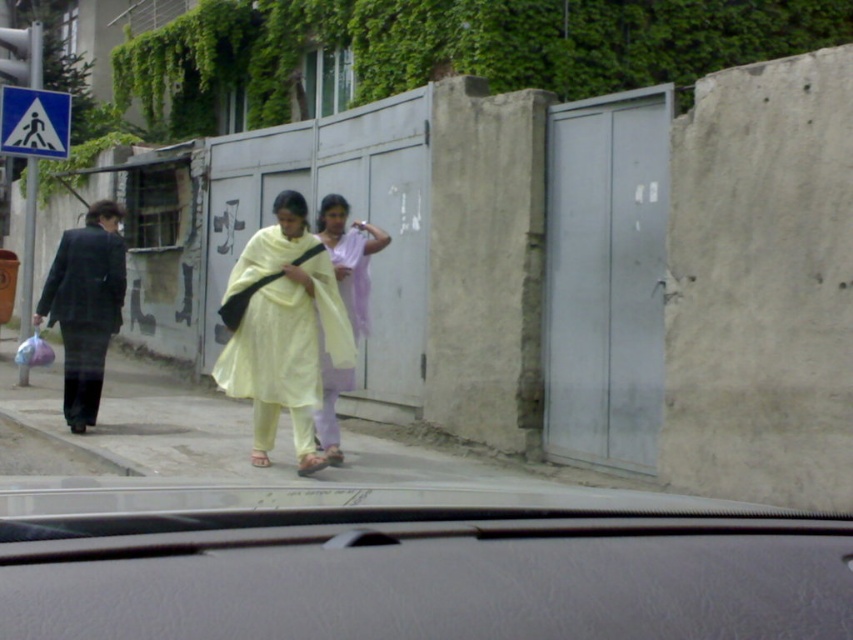
You are a passenger in the vehicle and notice an object at point [85,308]. What is located at that point?

The matte black suit at left is located at point [85,308].

You are a passenger in a car and notice two people walking on the sidewalk outside. You see the light yellow fabric at center and the matte black suit at left. Which one is more to the right from your viewpoint?

The light yellow fabric at center is more to the right because it is positioned on the right side of the matte black suit at left.

From the picture: You are a driver observing the scene outside your car. You notice a matte black suit at left and a light purple fabric at center. Which of these two items is taller?

The matte black suit at left is much taller than the light purple fabric at center, so the matte black suit at left is taller.